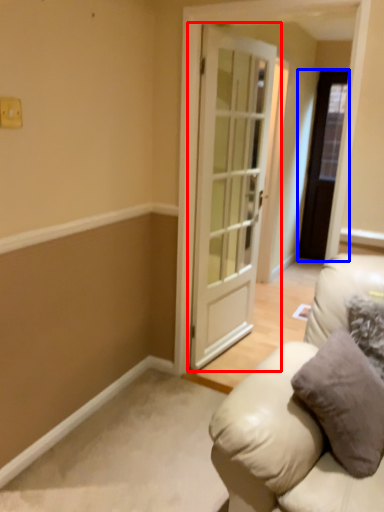
Question: Which object appears farthest to the camera in this image, door (highlighted by a red box) or door (highlighted by a blue box)?

Choices:
 (A) door
 (B) door

Answer: (B)